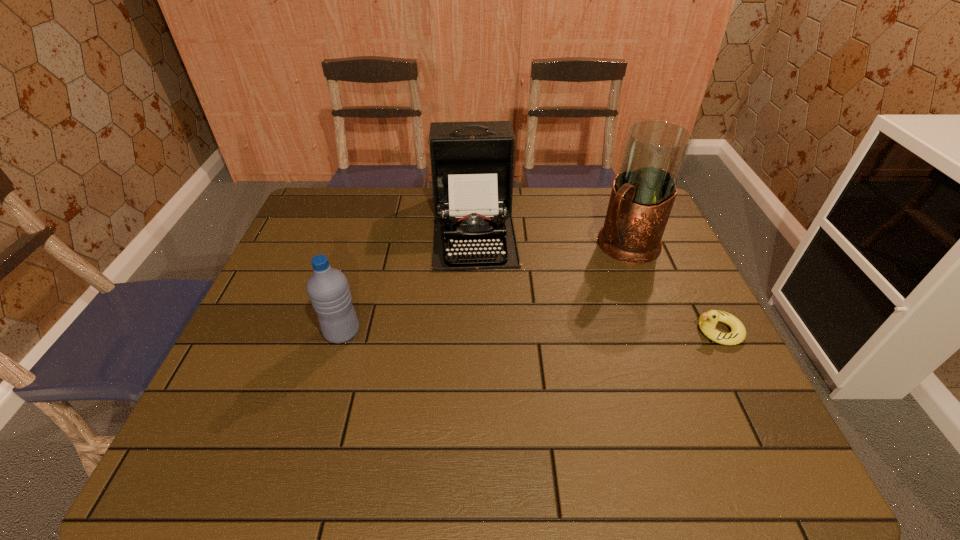
At what (x,y) coordinates should I click in order to perform the action: click on free spot on the desktop that is between the third tallest object and the shortest object and is positioned with the handle on the side of the pitcher. Please return your answer as a coordinate pair (x, y). Image resolution: width=960 pixels, height=540 pixels. Looking at the image, I should click on (531, 332).

Find the location of a particular element. vacant space on the desktop that is between the water bottle and the duckling and is positioned inside the open case of the typewriter is located at coordinates (482, 332).